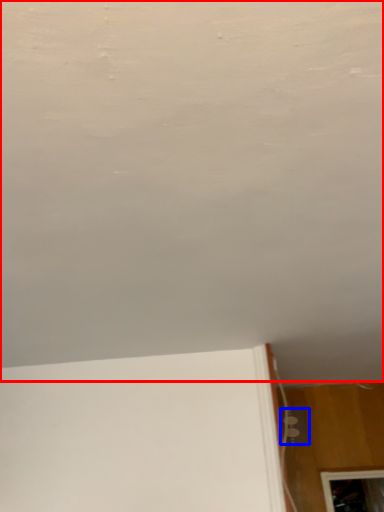
Question: Among these objects, which one is farthest to the camera, backdrop (highlighted by a red box) or electric outlet (highlighted by a blue box)?

Choices:
 (A) backdrop
 (B) electric outlet

Answer: (B)